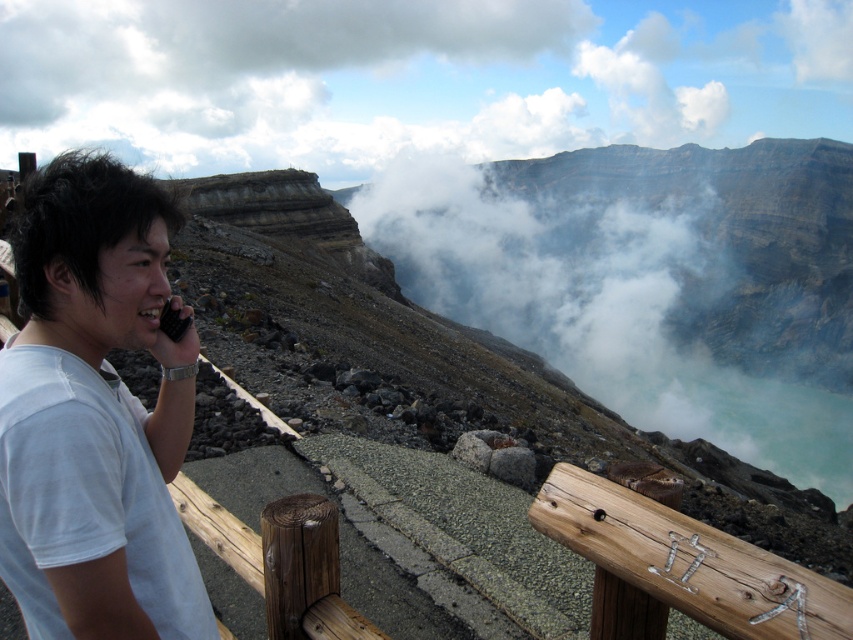
What do you see at coordinates (96, 413) in the screenshot?
I see `white cotton shirt at left` at bounding box center [96, 413].

Which of these two, white cotton shirt at left or black plastic phone at left, stands shorter?

black plastic phone at left is shorter.

Which is behind, point (33, 364) or point (184, 323)?

Positioned behind is point (184, 323).

You are a GUI agent. You are given a task and a screenshot of the screen. Output one action in this format:
    pyautogui.click(x=<x>, y=<y>)
    Task: Click on the white cotton shirt at left
    
    Given the screenshot: What is the action you would take?
    [96, 413]